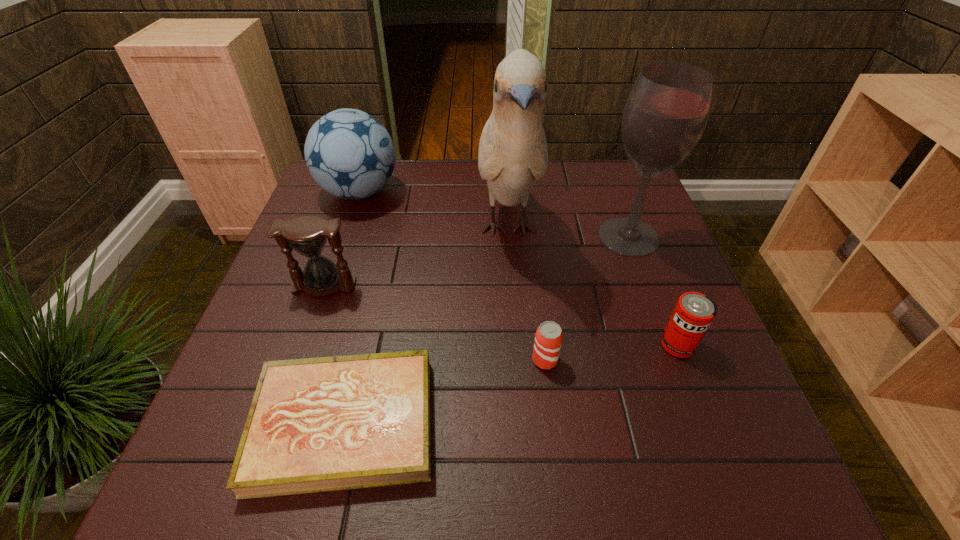
Locate an element on the screen. The image size is (960, 540). free space located 0.140m on the back of the hourglass is located at coordinates (342, 235).

The height and width of the screenshot is (540, 960). Identify the location of vacant point located on the left of the fifth tallest object. (603, 345).

Locate an element on the screen. vacant space located 0.240m on the back of the second shortest object is located at coordinates (534, 269).

The width and height of the screenshot is (960, 540). Find the location of `free space located 0.270m on the right of the shortest object`. free space located 0.270m on the right of the shortest object is located at coordinates (586, 424).

Locate an element on the screen. Image resolution: width=960 pixels, height=540 pixels. parakeet that is at the far edge is located at coordinates (513, 154).

Identify the location of soccer ball positioned at the far edge. (349, 153).

Image resolution: width=960 pixels, height=540 pixels. Identify the location of object at the near edge. tap(321, 424).

The image size is (960, 540). What are the coordinates of `soccer ball that is positioned at the left edge` in the screenshot? It's located at (349, 153).

The width and height of the screenshot is (960, 540). I want to click on hourglass that is positioned at the left edge, so click(307, 235).

This screenshot has width=960, height=540. Find the location of `hardback book present at the left edge`. hardback book present at the left edge is located at coordinates (321, 424).